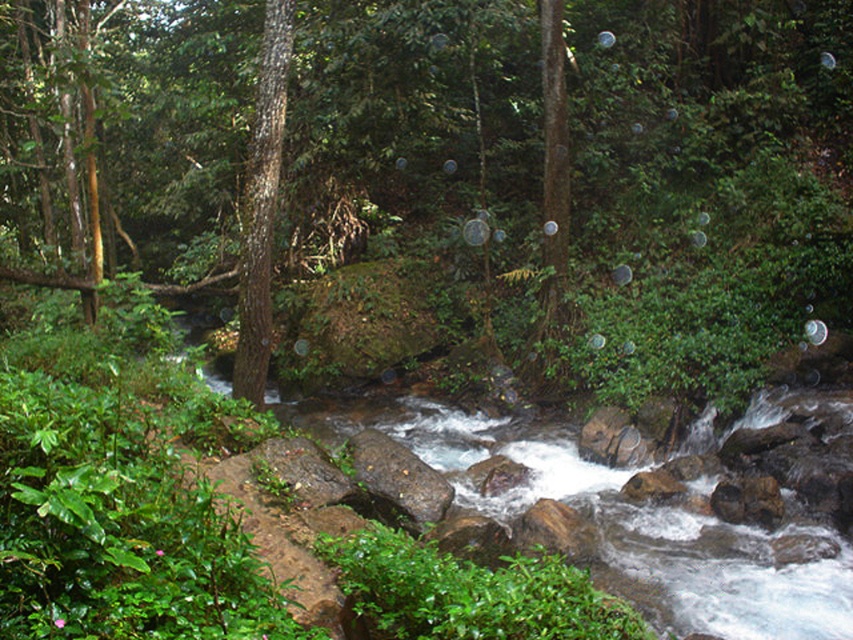
Question: Estimate the real-world distances between objects in this image. Which object is farther from the smooth brown rock at center?

Choices:
 (A) brown rough bark tree at center
 (B) green matte tree at center

Answer: (B)

Question: Does brown rough bark tree at center have a lesser width compared to smooth brown rock at center?

Choices:
 (A) no
 (B) yes

Answer: (B)

Question: Which point is closer to the camera?

Choices:
 (A) (436, 516)
 (B) (274, 200)
 (C) (187, 81)

Answer: (A)

Question: Is green matte tree at center thinner than smooth brown rock at center?

Choices:
 (A) yes
 (B) no

Answer: (B)

Question: Does brown rough bark tree at center appear on the right side of smooth brown rock at center?

Choices:
 (A) yes
 (B) no

Answer: (B)

Question: Among these points, which one is farthest from the camera?

Choices:
 (A) (53, 99)
 (B) (276, 112)
 (C) (367, 440)

Answer: (A)